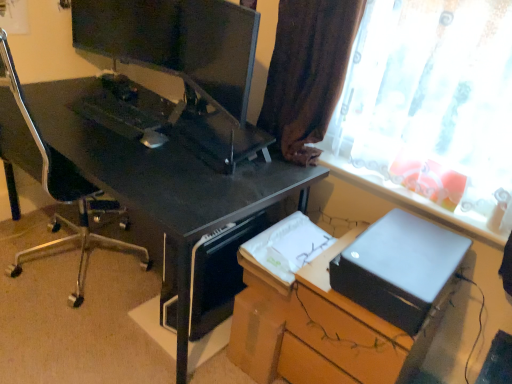
Question: Should I look upward or downward to see satin black printer at lower right?

Choices:
 (A) down
 (B) up

Answer: (A)

Question: Is brown fabric curtain at upper right smaller than satin black printer at lower right?

Choices:
 (A) yes
 (B) no

Answer: (A)

Question: Is brown fabric curtain at upper right to the right of satin black printer at lower right from the viewer's perspective?

Choices:
 (A) no
 (B) yes

Answer: (A)

Question: Can you confirm if brown fabric curtain at upper right is taller than satin black printer at lower right?

Choices:
 (A) no
 (B) yes

Answer: (B)

Question: From the image's perspective, is brown fabric curtain at upper right on top of satin black printer at lower right?

Choices:
 (A) no
 (B) yes

Answer: (B)

Question: Is satin black printer at lower right inside brown fabric curtain at upper right?

Choices:
 (A) no
 (B) yes

Answer: (A)

Question: Is the depth of brown fabric curtain at upper right less than that of satin black printer at lower right?

Choices:
 (A) no
 (B) yes

Answer: (A)

Question: Can you confirm if translucent fabric curtain at upper right is bigger than matte black monitor at upper center?

Choices:
 (A) yes
 (B) no

Answer: (A)

Question: Could you tell me if translucent fabric curtain at upper right is turned towards matte black monitor at upper center?

Choices:
 (A) yes
 (B) no

Answer: (B)

Question: From a real-world perspective, is translucent fabric curtain at upper right under matte black monitor at upper center?

Choices:
 (A) no
 (B) yes

Answer: (B)

Question: Considering the relative sizes of translucent fabric curtain at upper right and matte black monitor at upper center in the image provided, is translucent fabric curtain at upper right shorter than matte black monitor at upper center?

Choices:
 (A) no
 (B) yes

Answer: (A)

Question: From the image's perspective, is translucent fabric curtain at upper right under matte black monitor at upper center?

Choices:
 (A) no
 (B) yes

Answer: (B)

Question: Is translucent fabric curtain at upper right to the right of matte black monitor at upper center from the viewer's perspective?

Choices:
 (A) no
 (B) yes

Answer: (B)

Question: From the image's perspective, is black plastic computer tower at lower center over satin black printer at lower right?

Choices:
 (A) yes
 (B) no

Answer: (A)